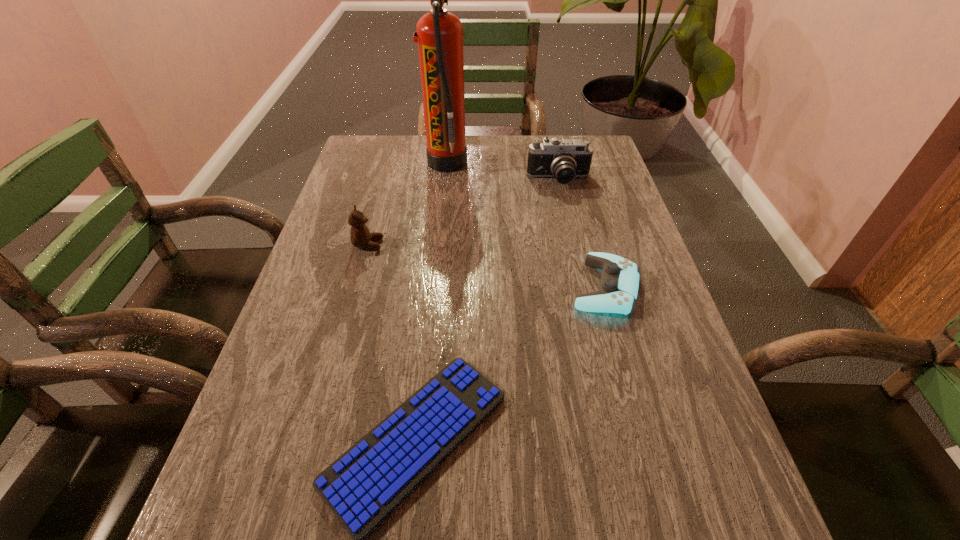
You are a GUI agent. You are given a task and a screenshot of the screen. Output one action in this format:
    pyautogui.click(x=<x>, y=<y>)
    Task: Click on the tallest object
    The height and width of the screenshot is (540, 960).
    Given the screenshot: What is the action you would take?
    pyautogui.click(x=439, y=35)

Identify the location of camera. (564, 159).

The width and height of the screenshot is (960, 540). Find the location of `the third farthest object`. the third farthest object is located at coordinates (360, 235).

You are a GUI agent. You are given a task and a screenshot of the screen. Output one action in this format:
    pyautogui.click(x=<x>, y=<y>)
    Task: Click on the second shortest object
    The height and width of the screenshot is (540, 960).
    Given the screenshot: What is the action you would take?
    pyautogui.click(x=618, y=288)

Find the location of a particular element. control is located at coordinates (618, 288).

Image resolution: width=960 pixels, height=540 pixels. I want to click on vacant region located 0.390m with the nozzle pointing from the back of the tallest object, so click(586, 163).

Where is `blank space located 0.170m on the front-facing side of the camera`? This screenshot has width=960, height=540. blank space located 0.170m on the front-facing side of the camera is located at coordinates pos(569,225).

Find the location of a particular element. This screenshot has height=540, width=960. vacant space located at the face of the teddy bear is located at coordinates (454, 244).

Where is `vacant space located on the right of the control`? Image resolution: width=960 pixels, height=540 pixels. vacant space located on the right of the control is located at coordinates (660, 287).

You are a GUI agent. You are given a task and a screenshot of the screen. Output one action in this format:
    pyautogui.click(x=<x>, y=<y>)
    Task: Click on the fire extinguisher that is at the far edge
    The height and width of the screenshot is (540, 960).
    Given the screenshot: What is the action you would take?
    pyautogui.click(x=439, y=35)